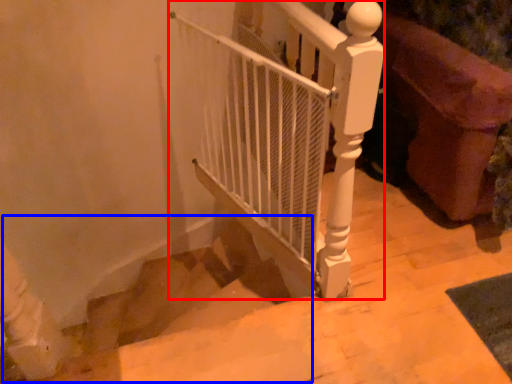
Question: Which object is closer to the camera taking this photo, fence (highlighted by a red box) or stairwell (highlighted by a blue box)?

Choices:
 (A) fence
 (B) stairwell

Answer: (A)